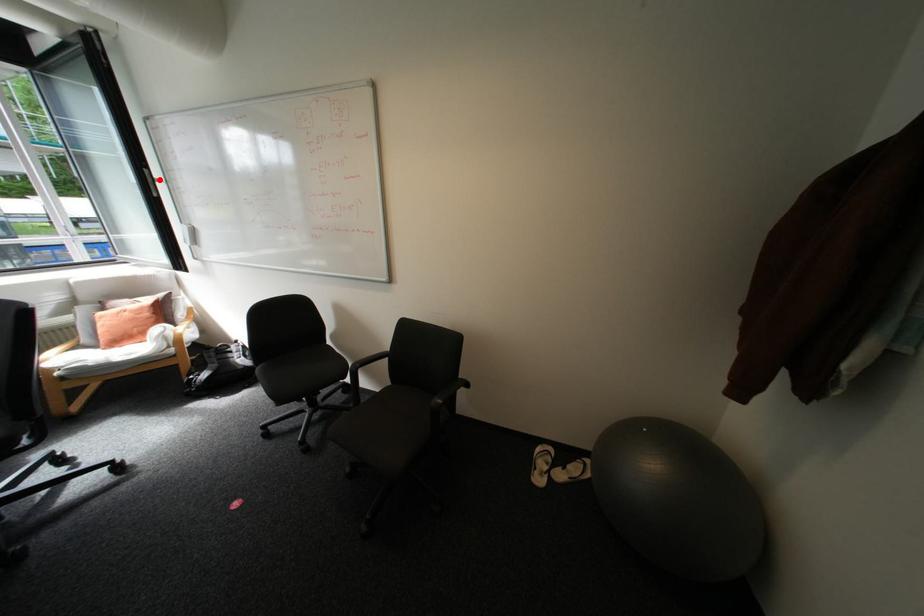
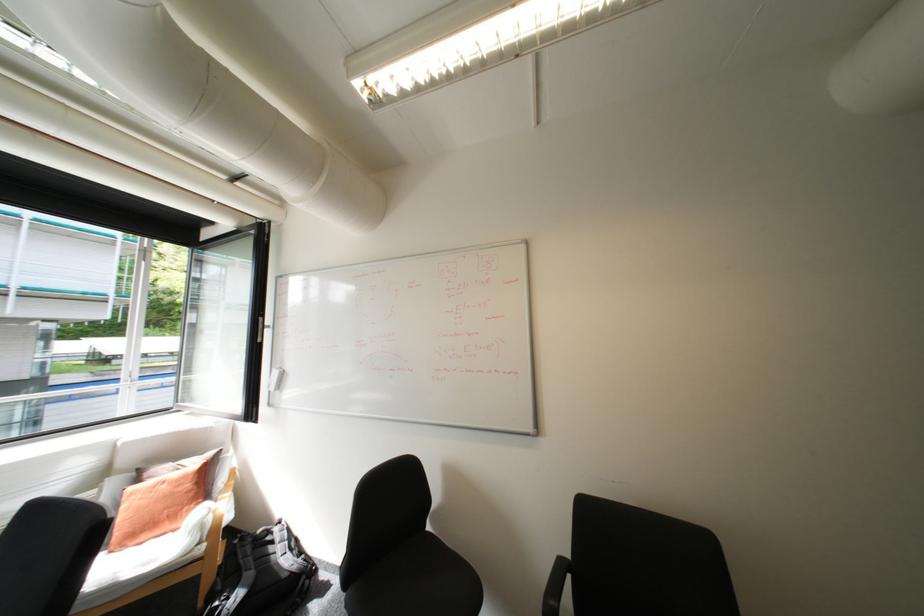
Locate, in the second image, the point that corresponds to the highlighted location in the first image.

(271, 326)